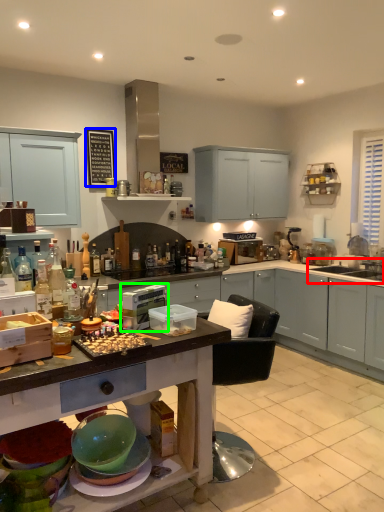
Question: Which object is the farthest from sink (highlighted by a red box)? Choose among these: bulletin board (highlighted by a blue box) or appliance (highlighted by a green box).

Choices:
 (A) bulletin board
 (B) appliance

Answer: (B)